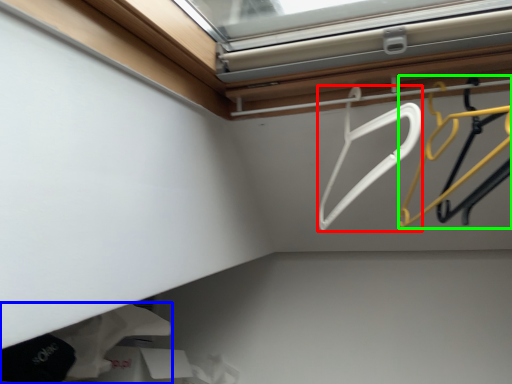
Question: Which is farther away from hanger (highlighted by a red box)? clothing (highlighted by a blue box) or hanger (highlighted by a green box)?

Choices:
 (A) clothing
 (B) hanger

Answer: (A)